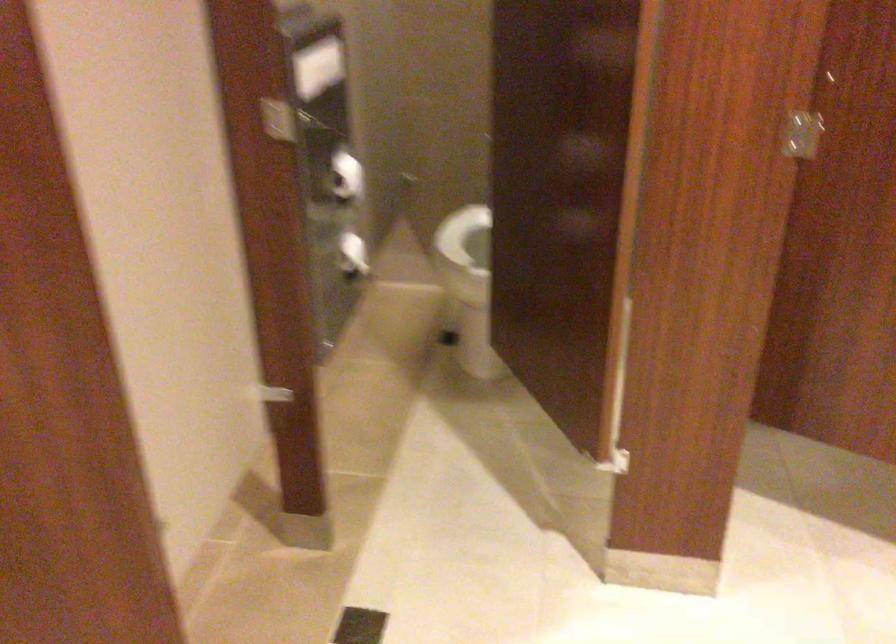
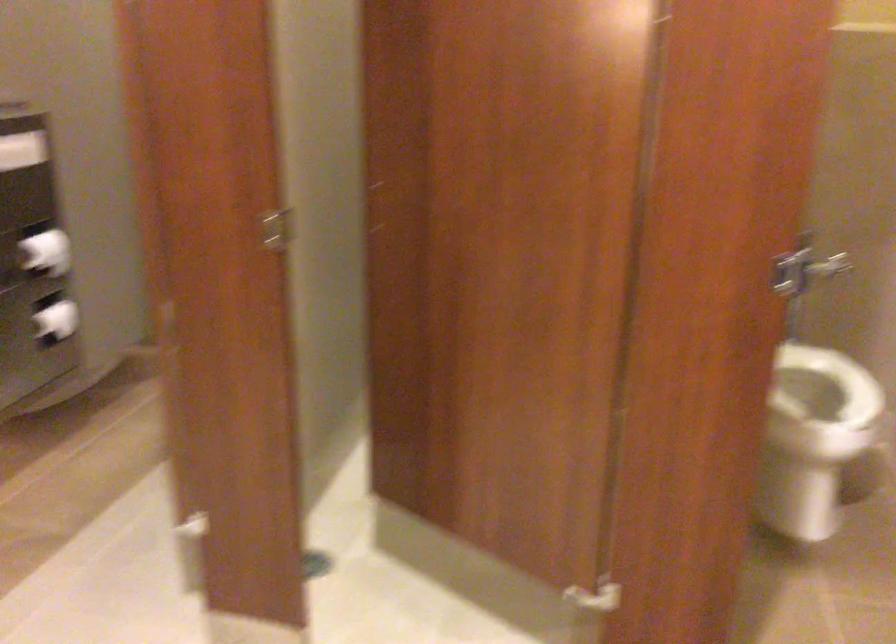
The point at (348, 261) is marked in the first image. Where is the corresponding point in the second image?

(56, 321)